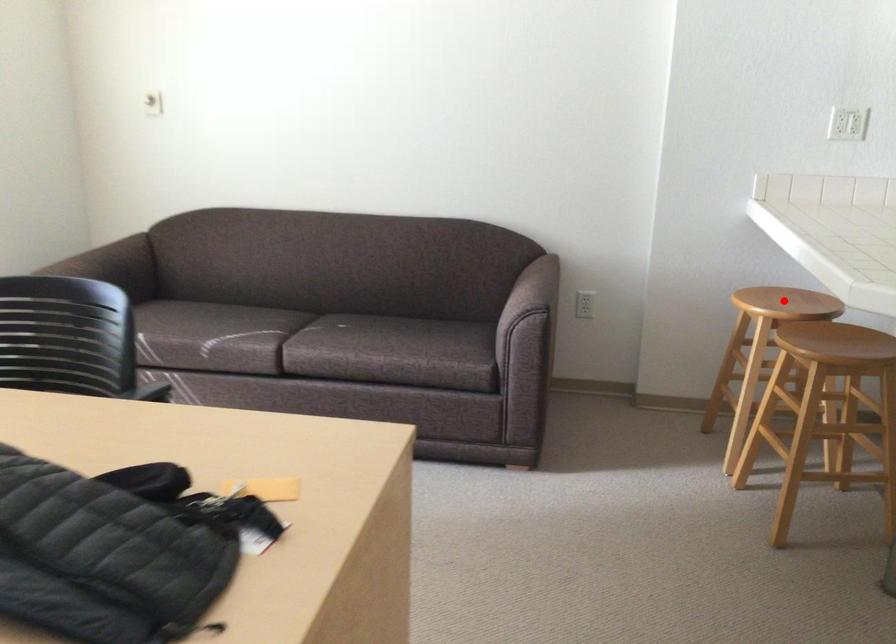
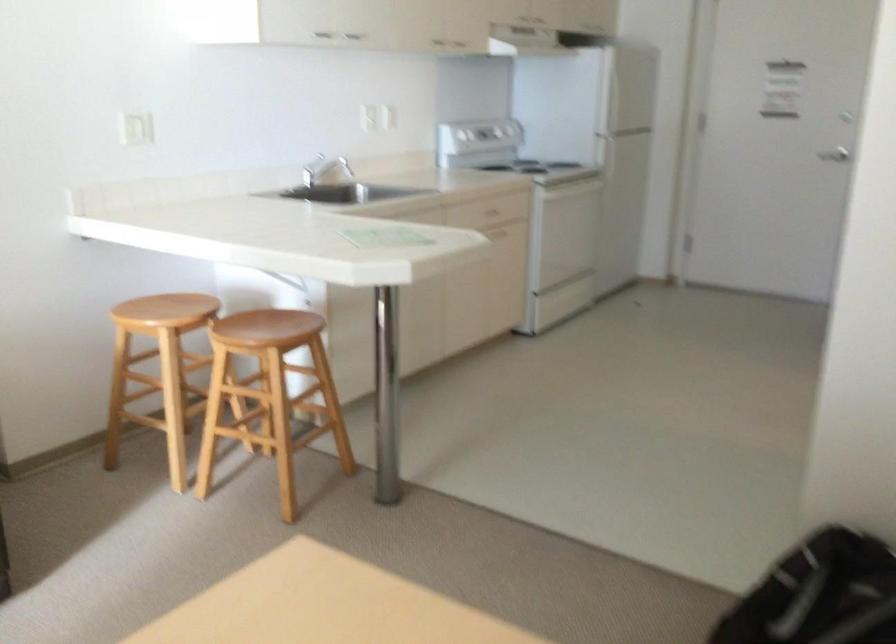
Locate, in the second image, the point that corresponds to the highlighted location in the first image.

(165, 310)